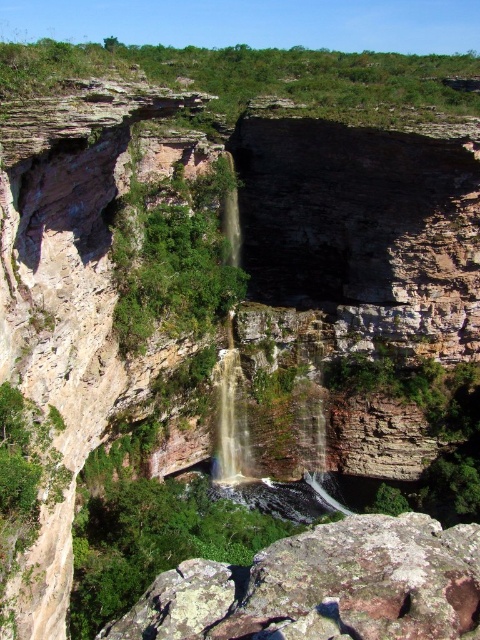
Question: Which point is closer to the camera?

Choices:
 (A) rusty rock at center
 (B) smooth rock waterfall at center

Answer: (A)

Question: Is rusty rock at center bigger than smooth rock waterfall at center?

Choices:
 (A) yes
 (B) no

Answer: (B)

Question: Observing the image, what is the correct spatial positioning of rusty rock at center in reference to smooth rock waterfall at center?

Choices:
 (A) left
 (B) right

Answer: (B)

Question: Which point is farther to the camera?

Choices:
 (A) rusty rock at center
 (B) smooth rock waterfall at center

Answer: (B)

Question: Does rusty rock at center appear over smooth rock waterfall at center?

Choices:
 (A) no
 (B) yes

Answer: (A)

Question: Among these objects, which one is farthest from the camera?

Choices:
 (A) smooth rock waterfall at center
 (B) rusty rock at center

Answer: (A)